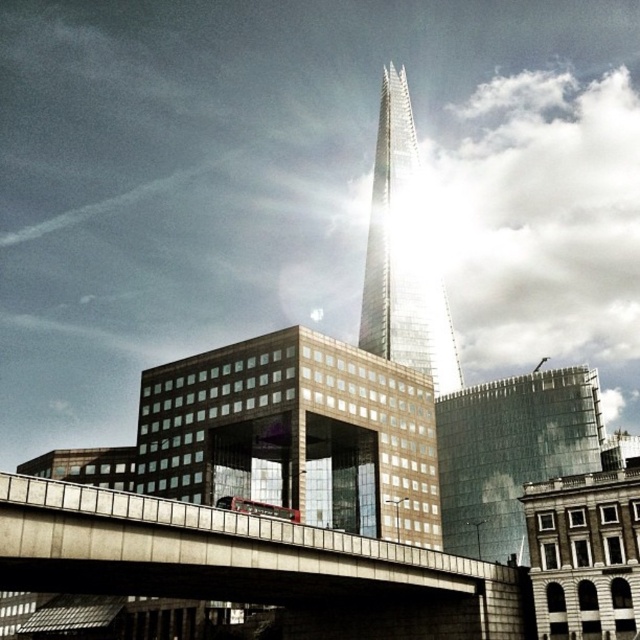
Question: Can you confirm if concrete bridge at center is positioned below shiny glass skyscraper at center?

Choices:
 (A) yes
 (B) no

Answer: (A)

Question: Among these objects, which one is nearest to the camera?

Choices:
 (A) concrete bridge at center
 (B) shiny glass skyscraper at center

Answer: (A)

Question: Which object appears closest to the camera in this image?

Choices:
 (A) concrete bridge at center
 (B) shiny glass skyscraper at center

Answer: (A)

Question: Is concrete bridge at center wider than shiny glass skyscraper at center?

Choices:
 (A) no
 (B) yes

Answer: (B)

Question: Which point is closer to the camera?

Choices:
 (A) shiny glass skyscraper at center
 (B) concrete bridge at center

Answer: (B)

Question: Does concrete bridge at center appear on the left side of shiny glass skyscraper at center?

Choices:
 (A) no
 (B) yes

Answer: (B)